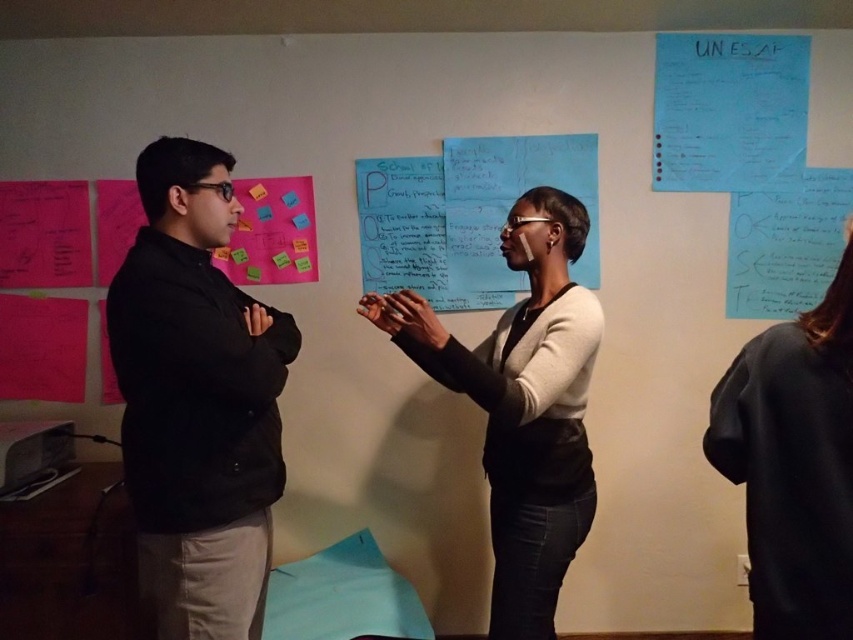
Question: Among these objects, which one is nearest to the camera?

Choices:
 (A) black matte jacket at left
 (B) black matte shirt at right
 (C) blue paper at upper right
 (D) blue paper at center

Answer: (B)

Question: Does black matte jacket at left lie behind bright pink paper at upper left?

Choices:
 (A) no
 (B) yes

Answer: (A)

Question: Does blue paper at upper right appear on the right side of blue paper at center?

Choices:
 (A) yes
 (B) no

Answer: (A)

Question: Estimate the real-world distances between objects in this image. Which object is closer to the blue paper at center?

Choices:
 (A) white matte sweater at center
 (B) bright pink paper at upper left
 (C) blue paper at upper right

Answer: (B)

Question: Is black matte shirt at right below bright pink paper at upper left?

Choices:
 (A) no
 (B) yes

Answer: (B)

Question: Among these objects, which one is nearest to the camera?

Choices:
 (A) bright pink paper at upper left
 (B) blue paper at center

Answer: (A)